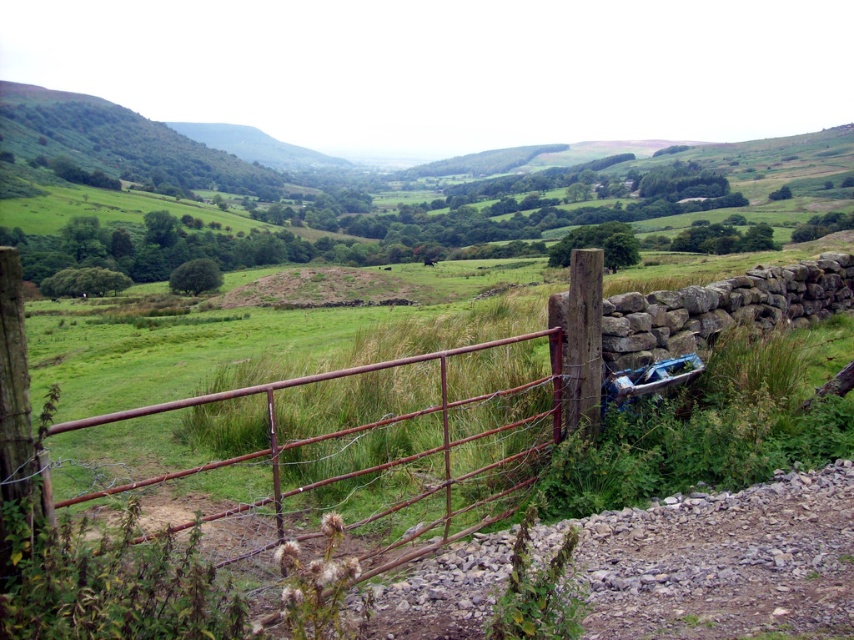
Looking at this image, measure the distance between point (509, 381) and camera.

Point (509, 381) is 22.54 feet from camera.

Is rusty metal gate at center positioned before metallic blue car at right?

That is True.

Identify the location of rusty metal gate at center. This screenshot has width=854, height=640. (385, 442).

Identify the location of rusty metal gate at center. (385, 442).